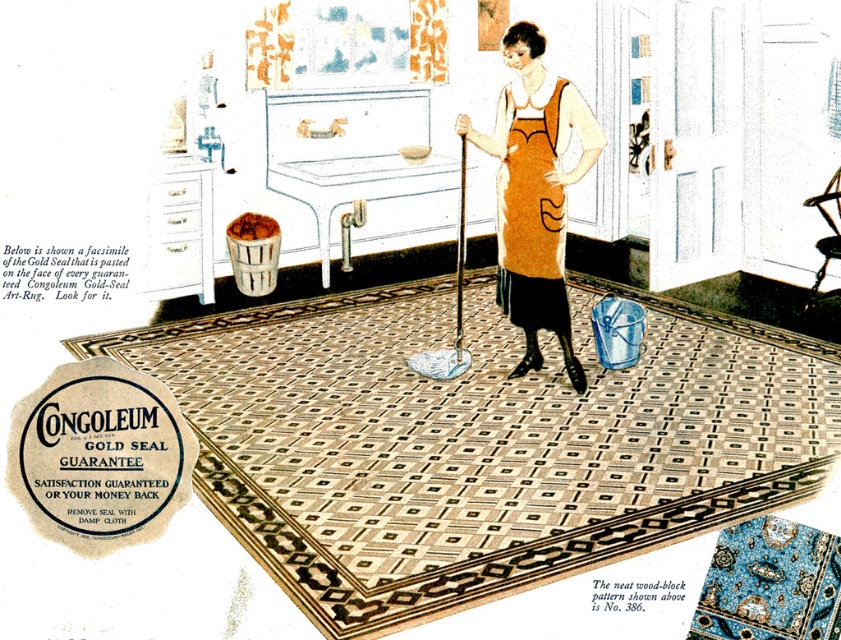
You are a fashion designer observing the vintage advertisement. You notice the orange fabric dress at center and the orange fabric apron at center. Which of these two items is longer in vertical length?

The orange fabric dress at center has a greater height compared to the orange fabric apron at center, so the dress is longer vertically.

In the vintage Congoleum Gold Seal flooring advertisement, there is a woman wearing an orange fabric dress at center and an orange fabric apron at center. Which piece of clothing is positioned to the right side?

The orange fabric dress at center is positioned to the right of the orange fabric apron at center.